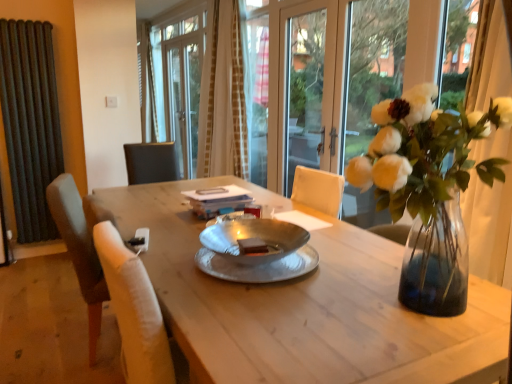
Question: From a real-world perspective, is wooden table at center above or below beige textured curtain at upper center?

Choices:
 (A) below
 (B) above

Answer: (A)

Question: Considering the positions of wooden table at center and beige textured curtain at upper center in the image, is wooden table at center taller or shorter than beige textured curtain at upper center?

Choices:
 (A) tall
 (B) short

Answer: (B)

Question: Which is farther from the dark gray radiator at left?

Choices:
 (A) transparent glass door at center
 (B) wooden table at center
 (C) clear glass vase at upper right
 (D) beige textured curtain at upper center

Answer: (C)

Question: Which object is positioned closest to the beige textured curtain at upper center?

Choices:
 (A) transparent glass door at center
 (B) wooden table at center
 (C) clear glass vase at upper right
 (D) dark gray radiator at left

Answer: (A)